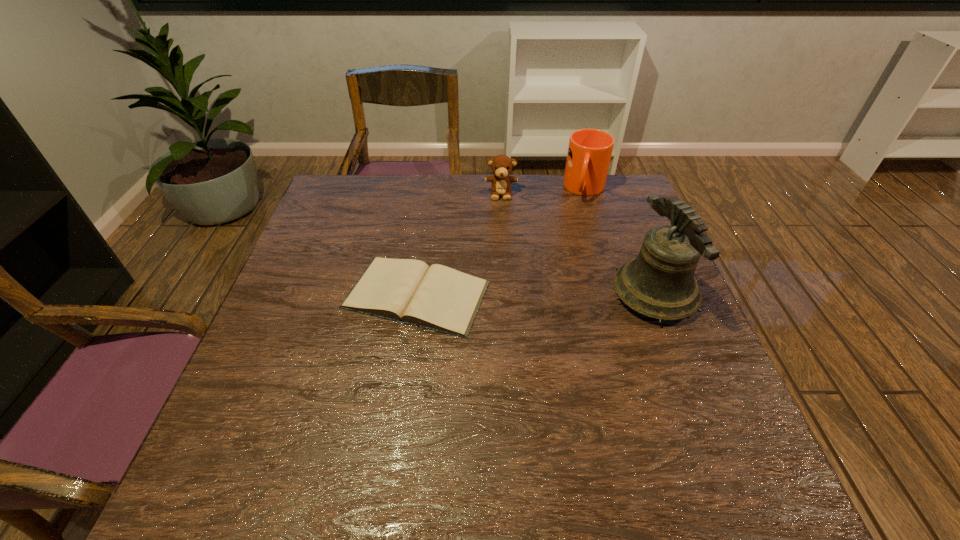
Find the location of a particular element. free spot at the right edge of the desktop is located at coordinates (611, 271).

Locate an element on the screen. This screenshot has height=540, width=960. vacant region at the far left corner of the desktop is located at coordinates (351, 212).

Find the location of a particular element. Image resolution: width=960 pixels, height=540 pixels. free space at the far right corner of the desktop is located at coordinates (636, 204).

This screenshot has width=960, height=540. What are the coordinates of `free space that is in between the shortest object and the second tallest object` in the screenshot? It's located at (501, 242).

Locate an element on the screen. The height and width of the screenshot is (540, 960). empty space that is in between the third shortest object and the tallest object is located at coordinates (619, 242).

This screenshot has height=540, width=960. I want to click on empty location between the second tallest object and the shortest object, so click(501, 242).

You are a GUI agent. You are given a task and a screenshot of the screen. Output one action in this format:
    pyautogui.click(x=<x>, y=<y>)
    Task: Click on the vacant space in between the mug and the Bible
    The width and height of the screenshot is (960, 540).
    Given the screenshot: What is the action you would take?
    pyautogui.click(x=501, y=242)

Find the location of a particular element. This screenshot has width=960, height=540. vacant space in between the bell and the teddy bear is located at coordinates (578, 244).

The image size is (960, 540). What are the coordinates of `empty space that is in between the bell and the second tallest object` in the screenshot? It's located at (619, 242).

This screenshot has width=960, height=540. What are the coordinates of `free point between the teddy bear and the Bible` in the screenshot? It's located at (459, 244).